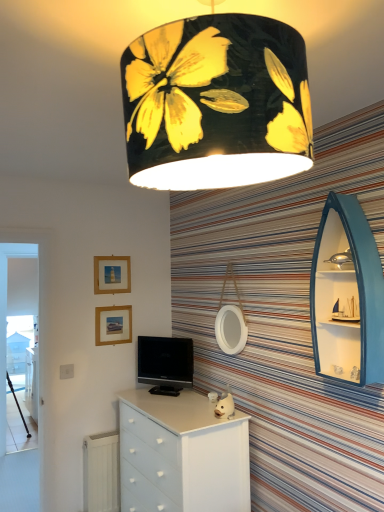
The height and width of the screenshot is (512, 384). I want to click on empty space that is ontop of white glossy chest of drawers at center (from a real-world perspective), so click(180, 403).